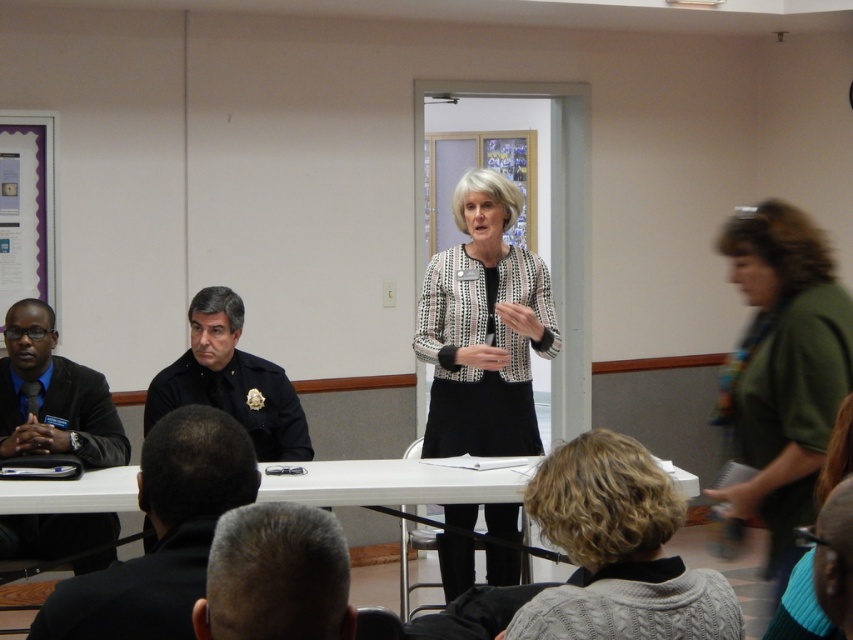
Is black and white checkered jacket at center above white plastic table at center?

Indeed, black and white checkered jacket at center is positioned over white plastic table at center.

From the picture: Is black and white checkered jacket at center positioned before white plastic table at center?

No.

Find the location of a particular element. Image resolution: width=853 pixels, height=640 pixels. black and white checkered jacket at center is located at coordinates (483, 328).

From the picture: Between green fabric jacket at right and white plastic table at center, which one appears on the left side from the viewer's perspective?

white plastic table at center is more to the left.

Who is lower down, green fabric jacket at right or white plastic table at center?

white plastic table at center

What are the coordinates of `green fabric jacket at right` in the screenshot? It's located at (781, 371).

This screenshot has width=853, height=640. What do you see at coordinates (392, 483) in the screenshot?
I see `white plastic table at center` at bounding box center [392, 483].

Looking at this image, is white plastic table at center above dark blue uniform at center?

Incorrect, white plastic table at center is not positioned above dark blue uniform at center.

Which is behind, point (375, 493) or point (289, 413)?

Positioned behind is point (289, 413).

Find the location of a particular element. white plastic table at center is located at coordinates (392, 483).